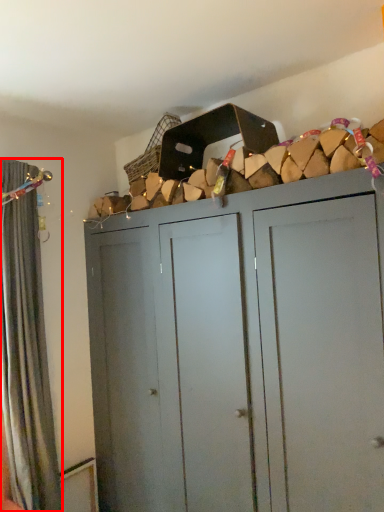
Question: From the image's perspective, where is curtain (annotated by the red box) located relative to cupboard?

Choices:
 (A) above
 (B) below

Answer: (A)